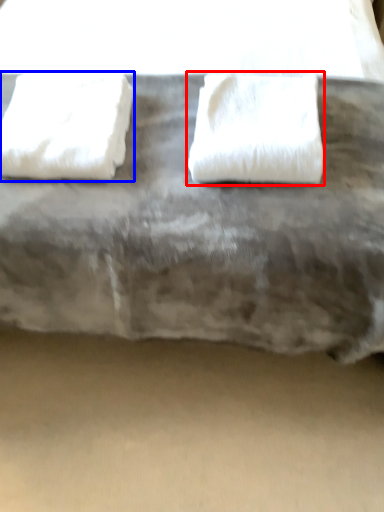
Question: Which of the following is the closest to the observer, towel (highlighted by a red box) or towel (highlighted by a blue box)?

Choices:
 (A) towel
 (B) towel

Answer: (A)